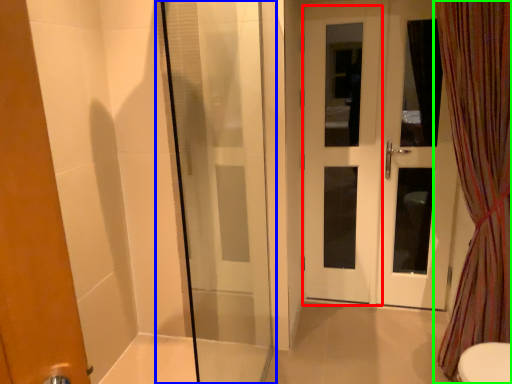
Question: Which object is the farthest from screen door (highlighted by a red box)? Choose among these: shower door (highlighted by a blue box) or curtain (highlighted by a green box).

Choices:
 (A) shower door
 (B) curtain

Answer: (B)